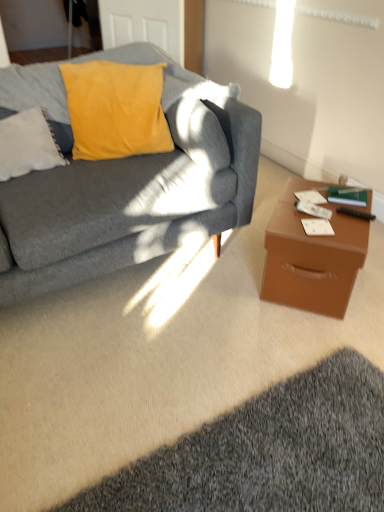
In order to click on free location to the left of brown leather desk at right in this screenshot , I will do `click(220, 286)`.